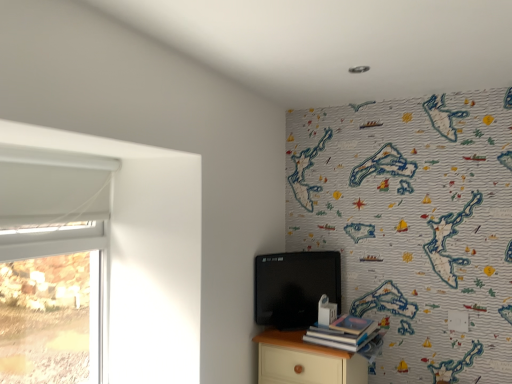
Question: Is light wood nightstand at lower right shorter than white plastic window at left?

Choices:
 (A) no
 (B) yes

Answer: (B)

Question: Is light wood nightstand at lower right to the left of white plastic window at left from the viewer's perspective?

Choices:
 (A) no
 (B) yes

Answer: (A)

Question: Can you confirm if light wood nightstand at lower right is bigger than white plastic window at left?

Choices:
 (A) no
 (B) yes

Answer: (B)

Question: From the image's perspective, would you say light wood nightstand at lower right is shown under white plastic window at left?

Choices:
 (A) yes
 (B) no

Answer: (A)

Question: Is light wood nightstand at lower right oriented towards white plastic window at left?

Choices:
 (A) no
 (B) yes

Answer: (A)

Question: In terms of width, does hardcover book at lower right look wider or thinner when compared to white plastic window at left?

Choices:
 (A) wide
 (B) thin

Answer: (A)

Question: Does point (342, 347) appear closer or farther from the camera than point (9, 311)?

Choices:
 (A) closer
 (B) farther

Answer: (A)

Question: Is hardcover book at lower right spatially inside white plastic window at left, or outside of it?

Choices:
 (A) outside
 (B) inside

Answer: (A)

Question: Considering their positions, is hardcover book at lower right located in front of or behind white plastic window at left?

Choices:
 (A) behind
 (B) front

Answer: (A)

Question: Considering the positions of point [x=365, y=329] and point [x=271, y=276], is point [x=365, y=329] closer or farther from the camera than point [x=271, y=276]?

Choices:
 (A) closer
 (B) farther

Answer: (A)

Question: Is hardcover book at lower right taller or shorter than matte black tv at center?

Choices:
 (A) short
 (B) tall

Answer: (A)

Question: In terms of width, does hardcover book at lower right look wider or thinner when compared to matte black tv at center?

Choices:
 (A) thin
 (B) wide

Answer: (B)

Question: From the image's perspective, is hardcover book at lower right located above or below matte black tv at center?

Choices:
 (A) above
 (B) below

Answer: (B)

Question: From a real-world perspective, is light wood nightstand at lower right physically located above or below hardcover book at lower right?

Choices:
 (A) above
 (B) below

Answer: (B)

Question: Considering the positions of light wood nightstand at lower right and hardcover book at lower right in the image, is light wood nightstand at lower right taller or shorter than hardcover book at lower right?

Choices:
 (A) short
 (B) tall

Answer: (B)